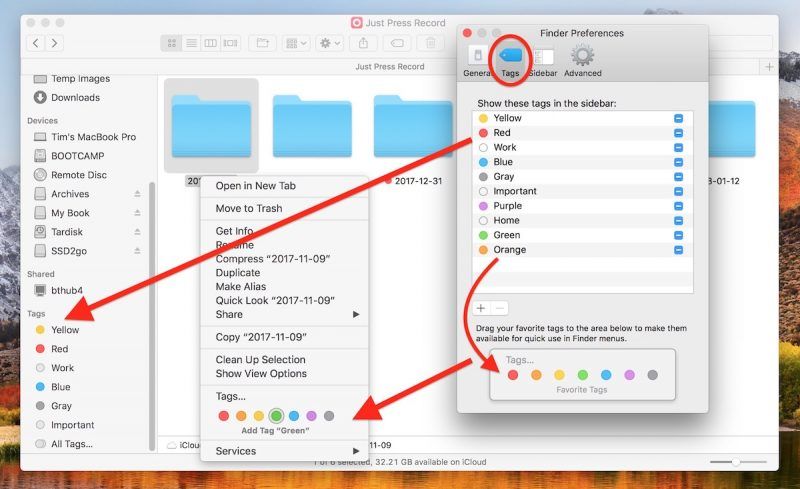
At what (x,y) coordinates should I click in order to perform the action: click on devices. Please return your answer as a coordinate pair (x, y). This screenshot has width=800, height=489. Looking at the image, I should click on (84, 137), (84, 157), (81, 175), (81, 194), (76, 214), (77, 233), (74, 252).